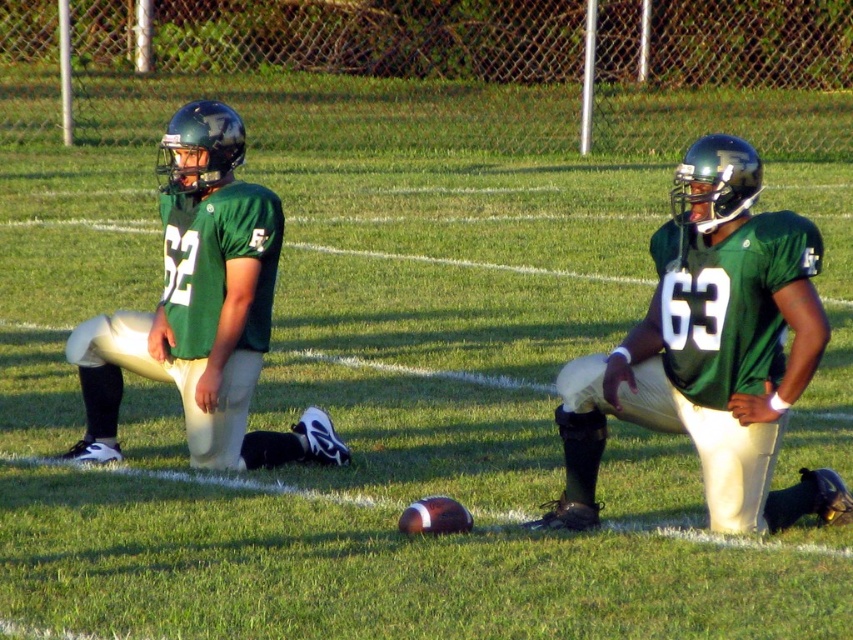
Question: Which object is closer to the camera taking this photo?

Choices:
 (A) green matte jersey at left
 (B) green matte jersey at center

Answer: (B)

Question: Does green matte jersey at center have a greater width compared to green matte jersey at left?

Choices:
 (A) yes
 (B) no

Answer: (A)

Question: Does green matte jersey at center come in front of green matte jersey at left?

Choices:
 (A) yes
 (B) no

Answer: (A)

Question: Considering the relative positions of green matte jersey at center and green matte jersey at left in the image provided, where is green matte jersey at center located with respect to green matte jersey at left?

Choices:
 (A) below
 (B) above

Answer: (A)

Question: Among these points, which one is nearest to the camera?

Choices:
 (A) (143, 355)
 (B) (666, 356)

Answer: (B)

Question: Which object appears closest to the camera in this image?

Choices:
 (A) green matte jersey at center
 (B) green matte jersey at left

Answer: (A)